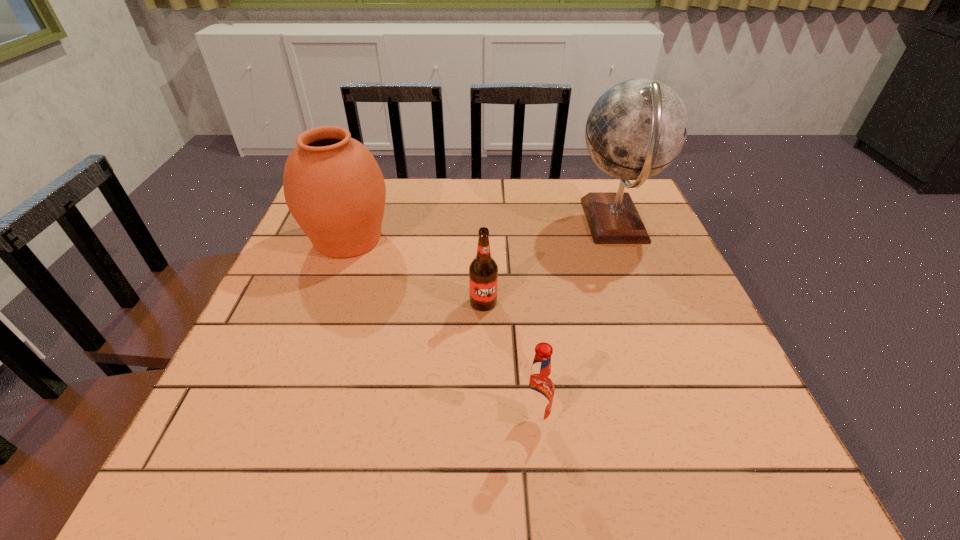
Find the location of `vacant space that satisfies the following two spatial constraints: 1. on the front side of the second object from right to left; 2. on the right side of the second object from left to right`. vacant space that satisfies the following two spatial constraints: 1. on the front side of the second object from right to left; 2. on the right side of the second object from left to right is located at coordinates (484, 419).